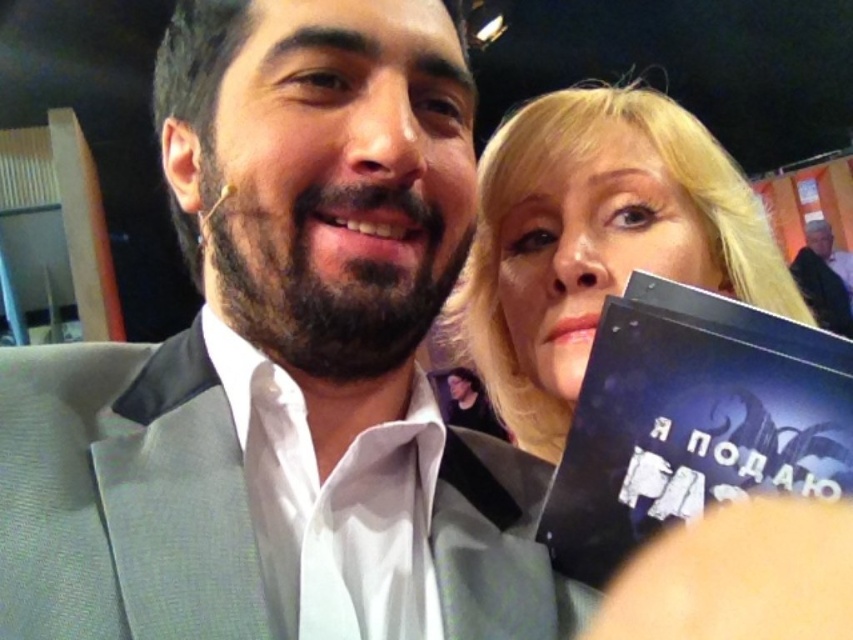
Question: Which object appears closest to the camera in this image?

Choices:
 (A) gray suit at center
 (B) dark blue hardcover book at right
 (C) blonde hair at upper right
 (D) light brown leather jacket at upper right

Answer: (A)

Question: Can you confirm if dark blue hardcover book at right is positioned to the left of light brown leather jacket at upper right?

Choices:
 (A) no
 (B) yes

Answer: (B)

Question: Which object is closer to the camera taking this photo?

Choices:
 (A) light brown leather jacket at upper right
 (B) blonde hair at upper right

Answer: (B)

Question: Which object appears closest to the camera in this image?

Choices:
 (A) light brown leather jacket at upper right
 (B) gray suit at center
 (C) dark blue hardcover book at right
 (D) blonde hair at upper right

Answer: (B)

Question: Is dark blue hardcover book at right behind light brown leather jacket at upper right?

Choices:
 (A) yes
 (B) no

Answer: (B)

Question: Is gray suit at center thinner than light brown leather jacket at upper right?

Choices:
 (A) no
 (B) yes

Answer: (B)